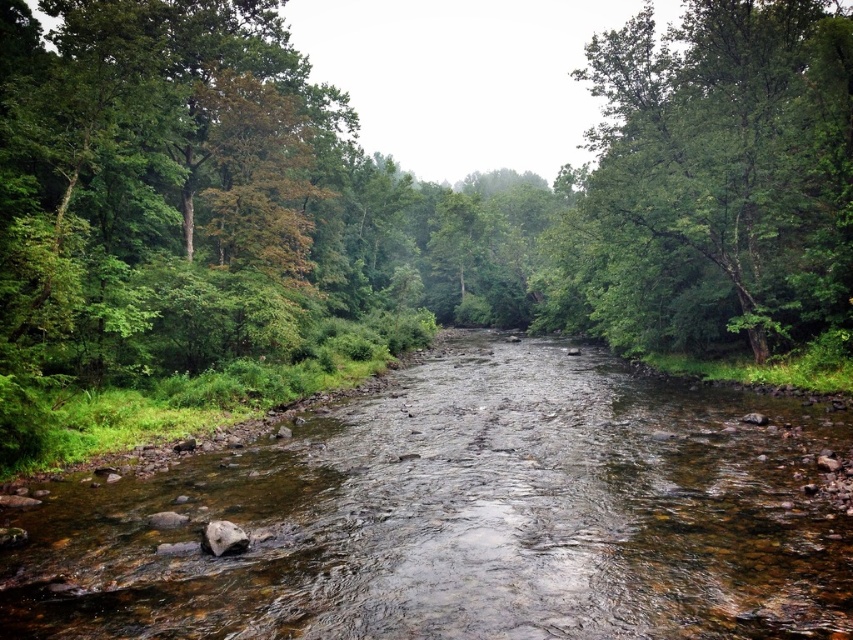
Question: Considering the relative positions of clear water at center and smooth gray rock at lower left in the image provided, where is clear water at center located with respect to smooth gray rock at lower left?

Choices:
 (A) left
 (B) right

Answer: (B)

Question: Estimate the real-world distances between objects in this image. Which object is closer to the smooth gray rock at lower left?

Choices:
 (A) clear water at center
 (B) green leafy forest at center
 (C) green leafy tree at right

Answer: (A)

Question: Which of the following is the farthest from the observer?

Choices:
 (A) (228, 541)
 (B) (38, 122)
 (C) (706, 12)
 (D) (834, 634)

Answer: (C)

Question: Is clear water at center closer to camera compared to green leafy tree at right?

Choices:
 (A) yes
 (B) no

Answer: (A)

Question: Is green leafy forest at center to the left of smooth gray rock at lower left from the viewer's perspective?

Choices:
 (A) no
 (B) yes

Answer: (A)

Question: Which of the following is the closest to the observer?

Choices:
 (A) (236, 548)
 (B) (844, 301)
 (C) (265, 202)
 (D) (605, 483)

Answer: (A)